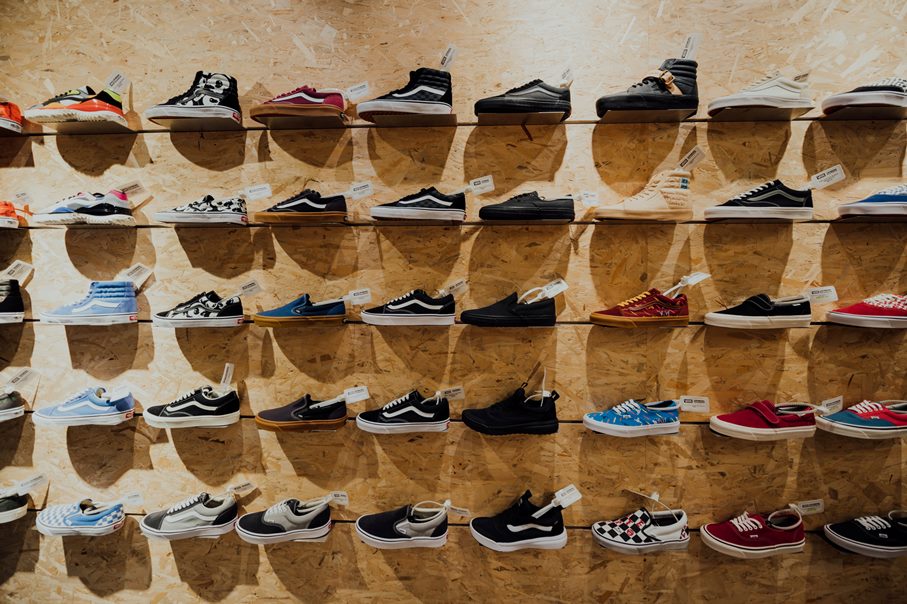
Find the location of a particular element. The width and height of the screenshot is (907, 604). shoes on top shelf is located at coordinates (6, 117), (74, 106), (198, 103), (299, 104), (401, 100), (505, 103), (651, 100), (753, 103), (874, 97).